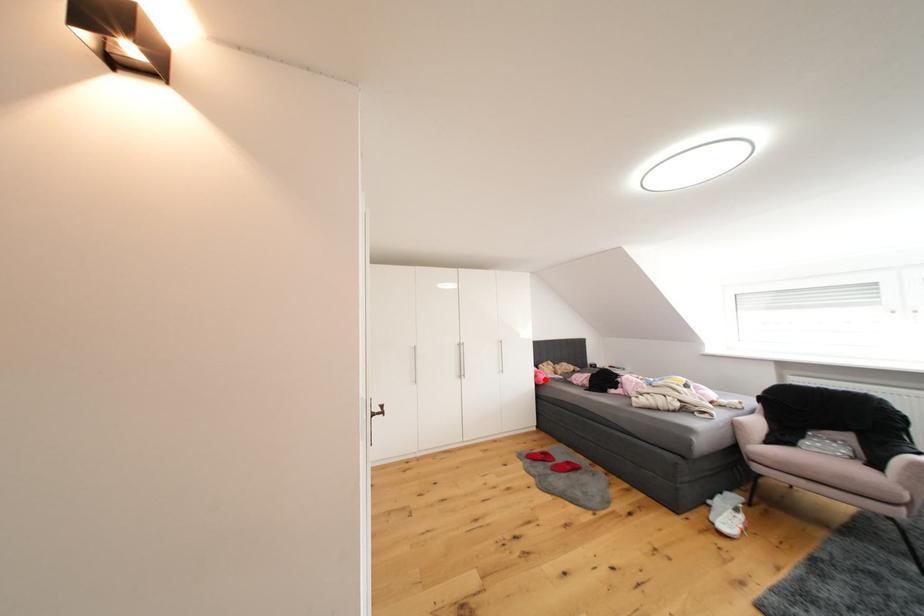
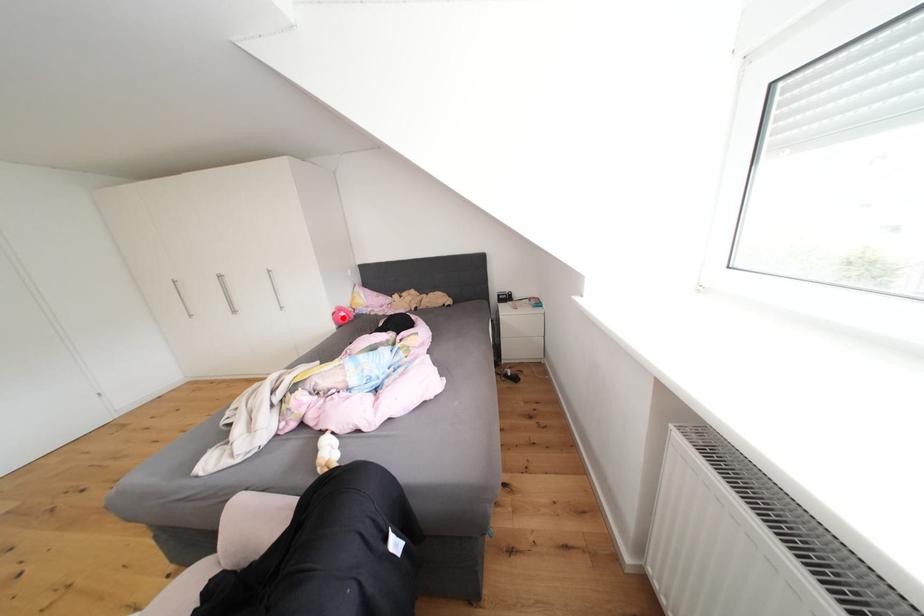
I am providing you with two images of the same scene from different viewpoints. A red point is marked on the first image and another point is marked on the second image. Do the highlighted points in image1 and image2 indicate the same real-world spot?

Yes